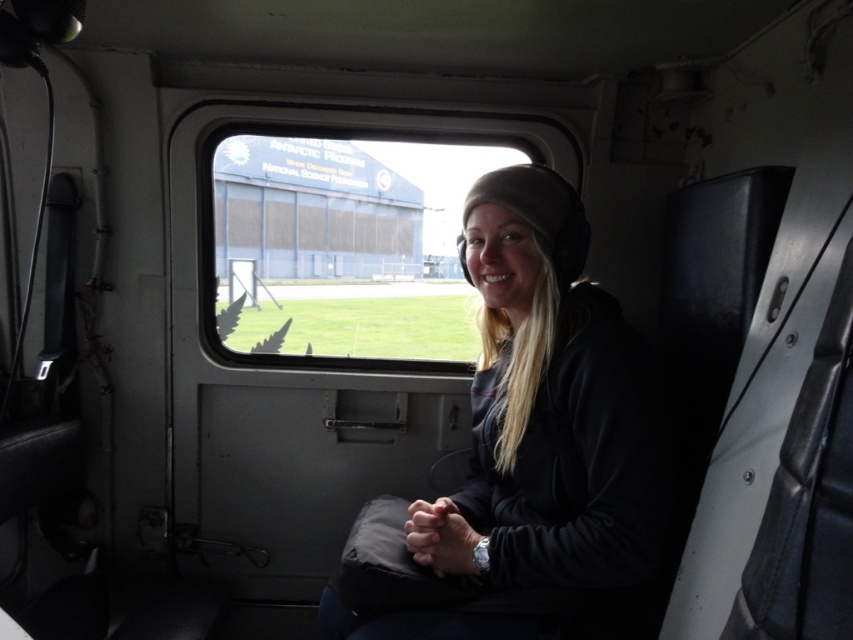
You are a passenger in the helicopter and want to take a photo of the United States Antarctic Program building outside. However, you notice that the black fleece jacket at center is blocking your view through the clear glass window at center. Can you move the jacket to get a clear shot?

The black fleece jacket at center is in front of the clear glass window at center, so moving the jacket would allow you to see through the window clearly and take the photo.

You are a passenger in the helicopter and need to know which item is narrower between the black fleece jacket at center and the clear glass window at center. Which one is it?

The black fleece jacket at center is thinner than the clear glass window at center, so the black fleece jacket at center is narrower.